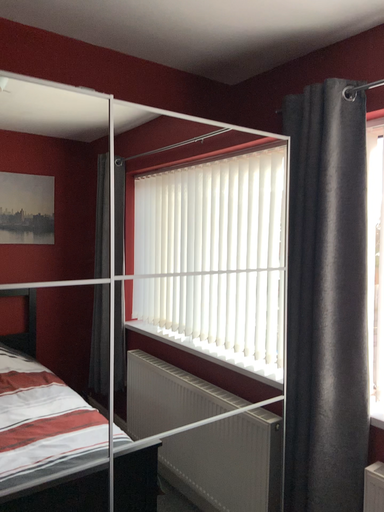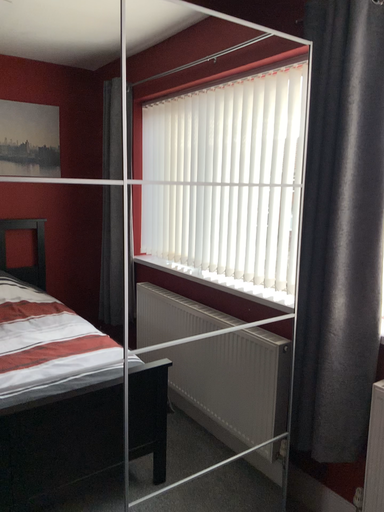
Question: Which way did the camera rotate in the video?

Choices:
 (A) rotated downward
 (B) rotated upward

Answer: (A)